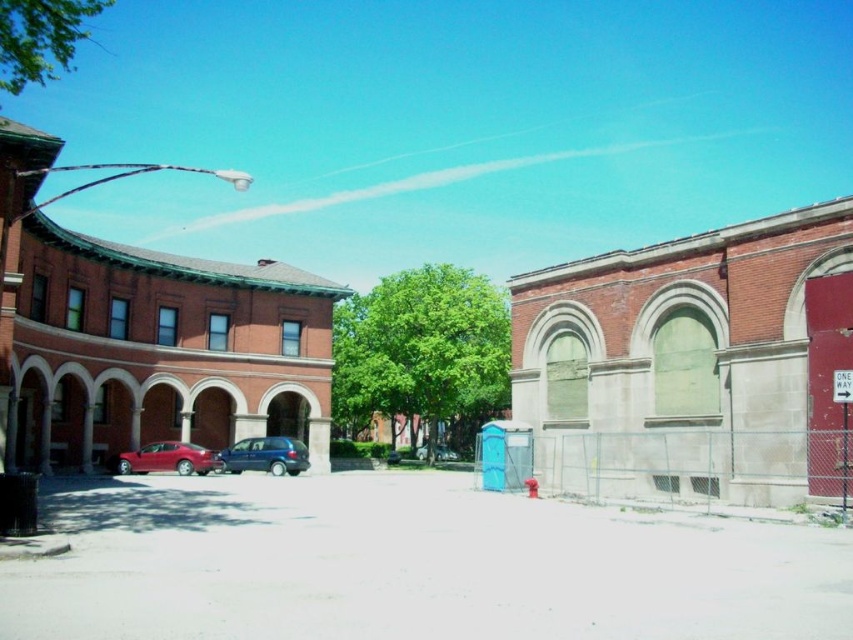
You are a delivery person trying to park your van, which is 2 meters tall, in this area. The shiny red sedan at lower left is blocking part of the path. Based on their heights, can your van pass under the white plastic sign at upper right without hitting it?

The shiny red sedan at lower left is taller than the white plastic sign at upper right. Since your van is 2 meters tall, and the sign is shorter than the sedan, the van may not be able to pass under the sign without hitting it.

You are standing in the urban area shown in the image and want to cross the street to reach the two story brick building with curved facade. The road is 217.96 feet wide. Is the shiny red sedan at lower left blocking your path?

The distance between the shiny red sedan at lower left and the viewer is 217.96 feet, which matches the road width. Since the sedan is parked at the lower left, it might be positioned near the curb of the building side. However, the exact path blockage isn

You are standing at the point where the red car is parked in front of the two story brick building with curved facade. Looking towards the street sign represented by point [843,422], which direction should you turn to face the white plastic street sign at right?

The white plastic street sign at right is located to your right side, so you should turn to your right to face it.